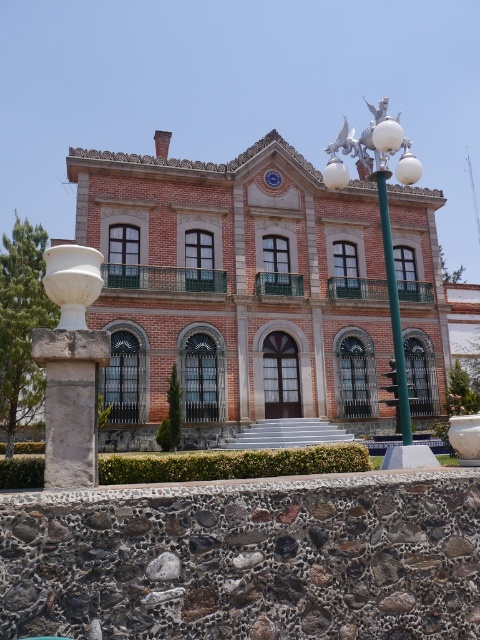
You are standing in front of the grand building and want to place a new decorative item between the white stone vase at left and the green metallic pole at center. Based on their positions, where should you place the new item?

The white stone vase at left is to the left of the green metallic pole at center, so you should place the new decorative item between them, to the right of the white stone vase at left and to the left of the green metallic pole at center.